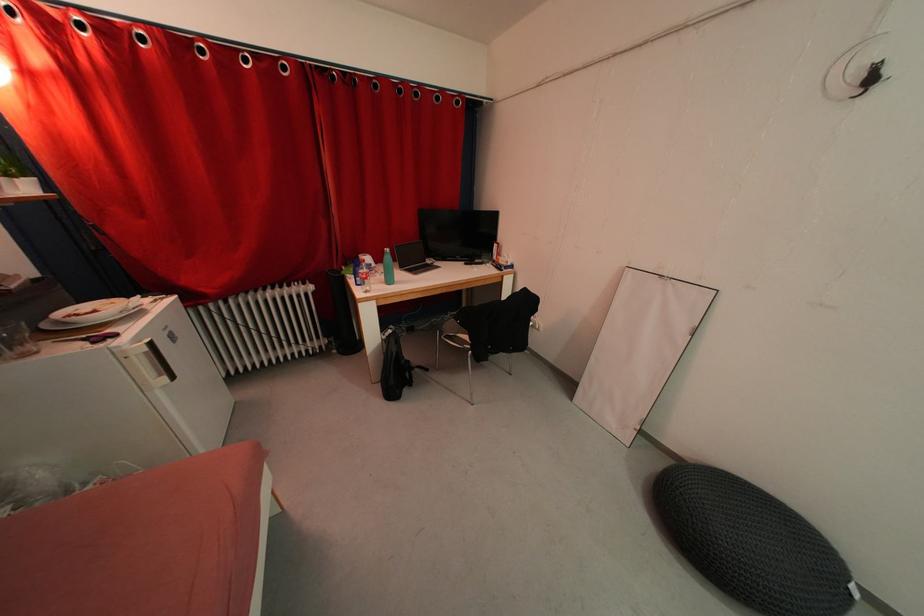
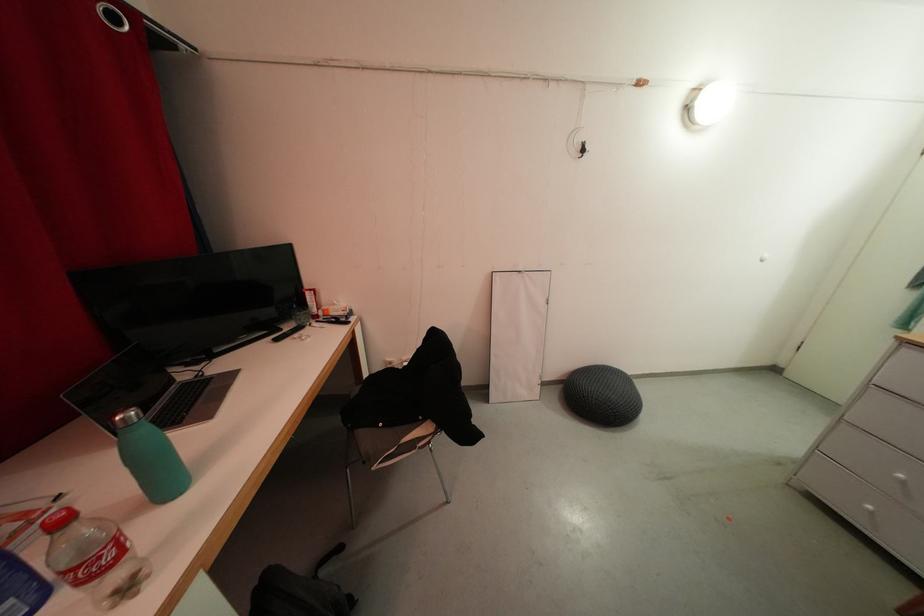
Locate, in the second image, the point that corresponds to point (372, 294) in the first image.

(134, 593)